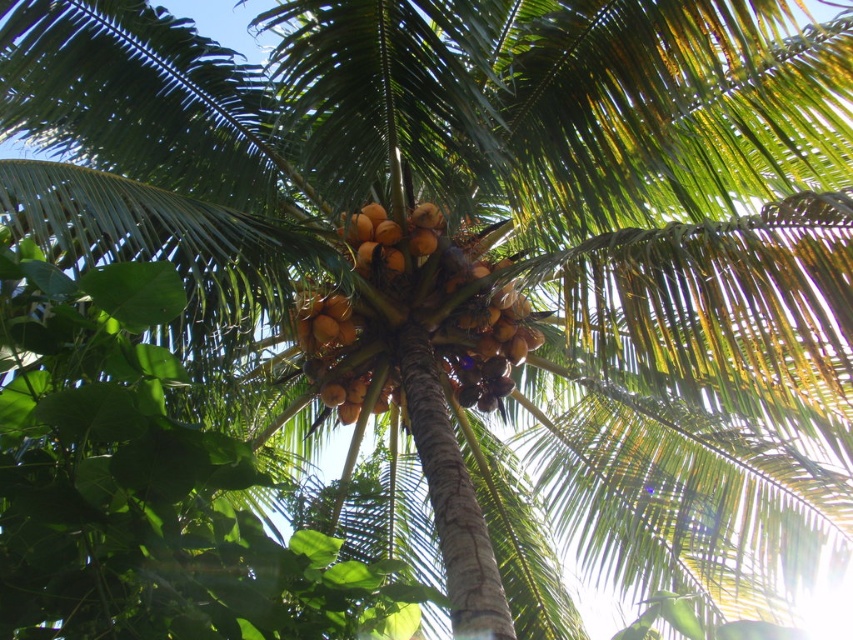
Who is more forward, (532, 348) or (381, 227)?

Positioned in front is point (381, 227).

Between point (442, 292) and point (373, 250), which one is positioned behind?

The point (442, 292) is behind.

Identify the location of yellowish brown coconuts at center. Image resolution: width=853 pixels, height=640 pixels. (445, 296).